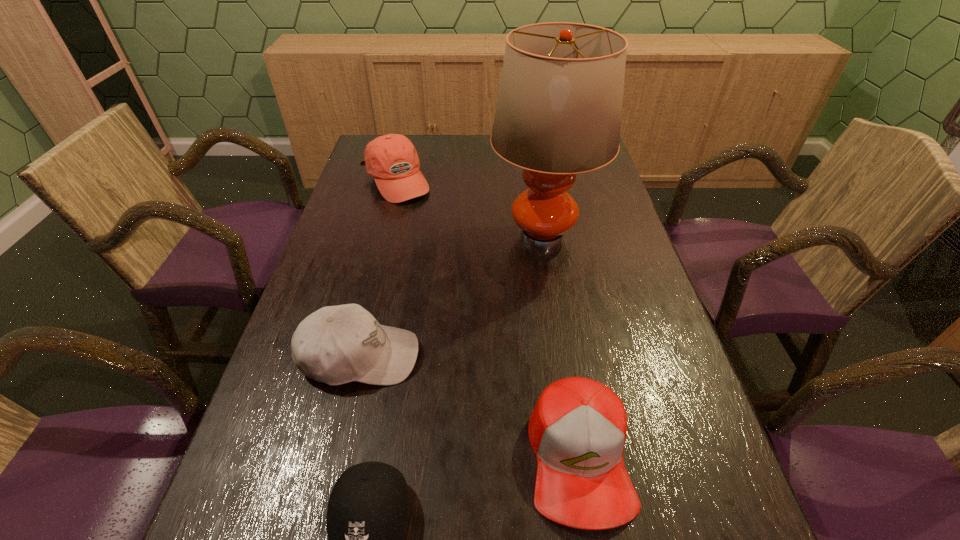
This screenshot has height=540, width=960. Identify the location of object situated at the far left corner. (392, 159).

Image resolution: width=960 pixels, height=540 pixels. Find the location of `vacant space at the left edge`. vacant space at the left edge is located at coordinates (391, 210).

This screenshot has width=960, height=540. In order to click on vacant space at the right edge of the desktop in this screenshot , I will do `click(619, 293)`.

At what (x,y) coordinates should I click in order to perform the action: click on vacant space that is in between the farthest baseball cap and the third nearest object. Please return your answer as a coordinate pair (x, y). Looking at the image, I should click on (378, 269).

Locate an element on the screen. free area in between the third nearest object and the rightmost baseball cap is located at coordinates (x=469, y=407).

Find the location of a particular element. empty location between the rightmost baseball cap and the third nearest baseball cap is located at coordinates (469, 407).

This screenshot has width=960, height=540. In order to click on vacant area that lies between the rightmost baseball cap and the second farthest baseball cap in this screenshot , I will do `click(469, 407)`.

This screenshot has width=960, height=540. Identify the location of vacant area between the rightmost baseball cap and the second farthest baseball cap. (469, 407).

In order to click on vacant region between the rightmost baseball cap and the farthest baseball cap in this screenshot , I will do `click(488, 319)`.

This screenshot has height=540, width=960. Identify the location of unoccupied position between the farthest baseball cap and the lamp. click(x=469, y=208).